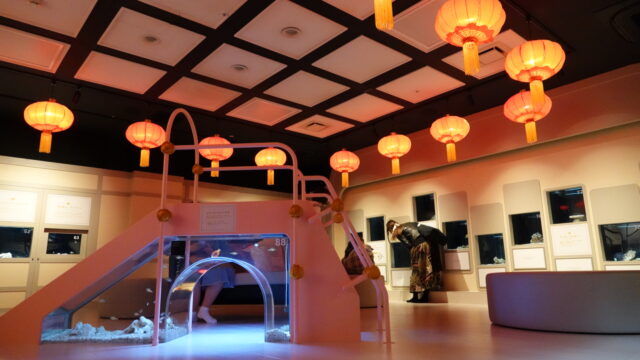
Identify the location of lantern. (456, 14).